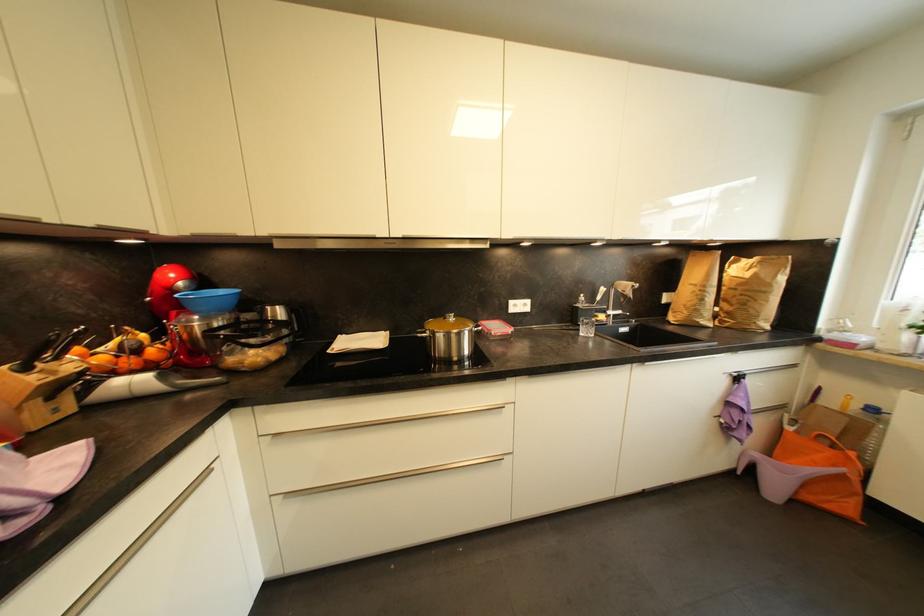
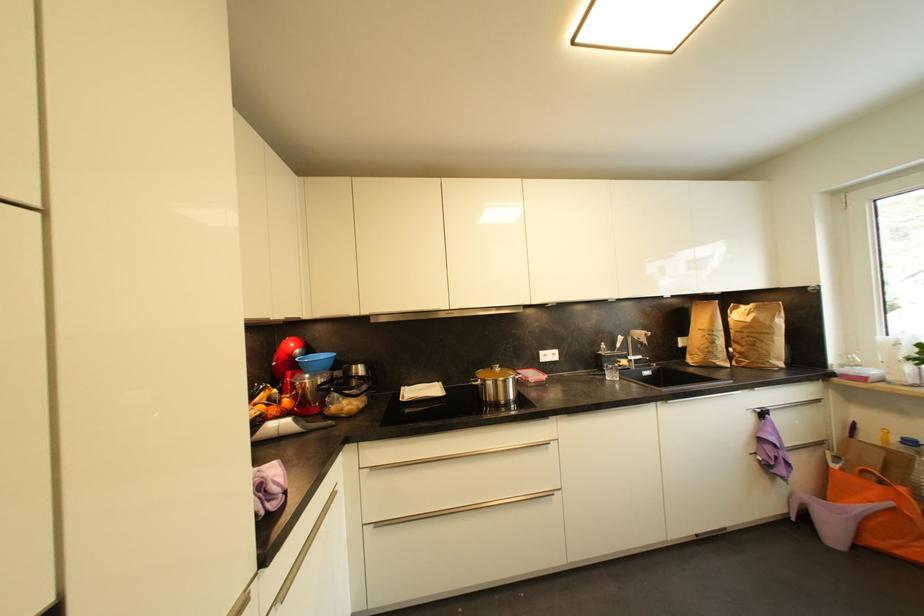
In the second image, find the point that corresponds to point 786,408 in the first image.

(825, 446)